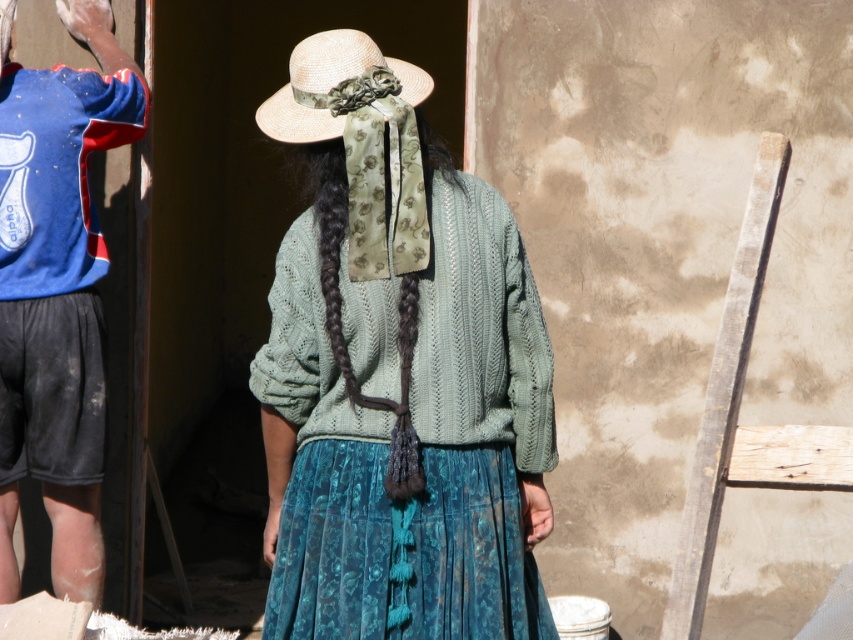
You are standing at the origin point in the image. There is a green knitted sweater at center marked by point (398, 376). If you walk directly towards the point, will you reach the sweater?

Yes, walking directly towards point (398, 376) will lead you to the green knitted sweater at center as the point marks its location.

You are a photographer trying to capture a candid shot of both the blue fabric shirt at left and the dark brown braided hair at center. Since you want to ensure both subjects are in focus, you need to know their relative heights. Which one is taller?

The blue fabric shirt at left is much taller than the dark brown braided hair at center, so you should focus on the blue fabric shirt at left first as it is taller.

You are standing at point [737,413] in the image. What object is directly in front of you?

The wooden plank at right is directly in front of you at point [737,413].